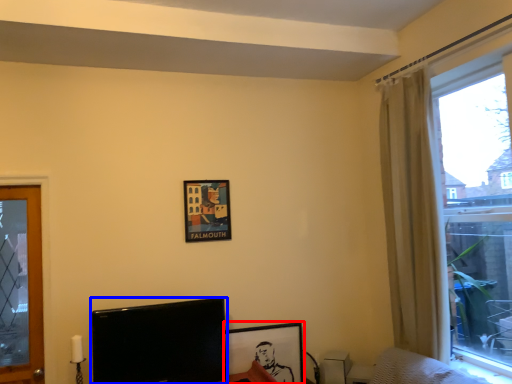
Question: Which object appears farthest to the camera in this image, picture frame (highlighted by a red box) or television (highlighted by a blue box)?

Choices:
 (A) picture frame
 (B) television

Answer: (A)